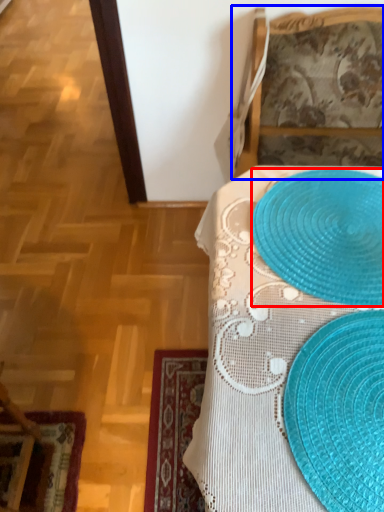
Question: Which object is closer to the camera taking this photo, platter (highlighted by a red box) or furniture (highlighted by a blue box)?

Choices:
 (A) platter
 (B) furniture

Answer: (A)